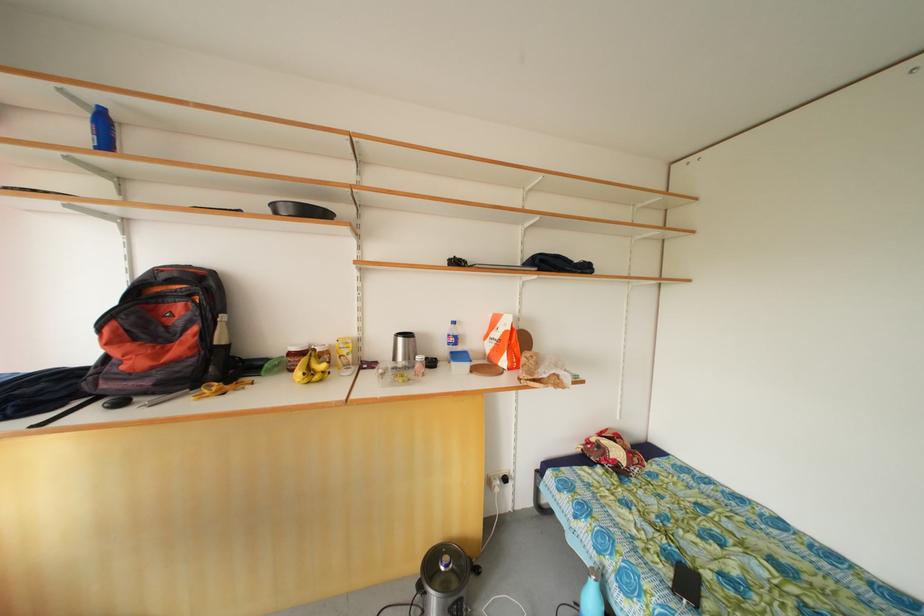
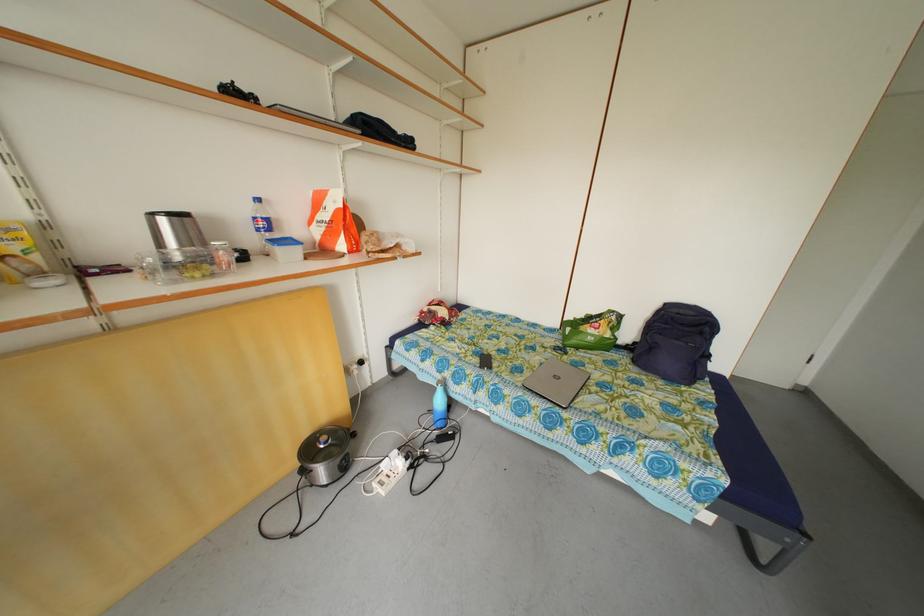
Where in the second image is the point corresponding to pixel 458 346 from the first image?

(270, 230)